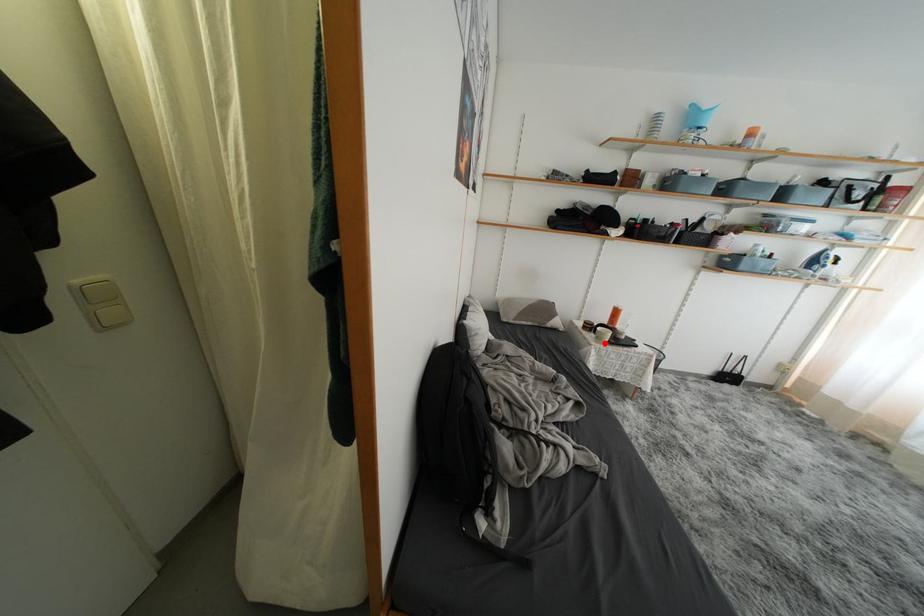
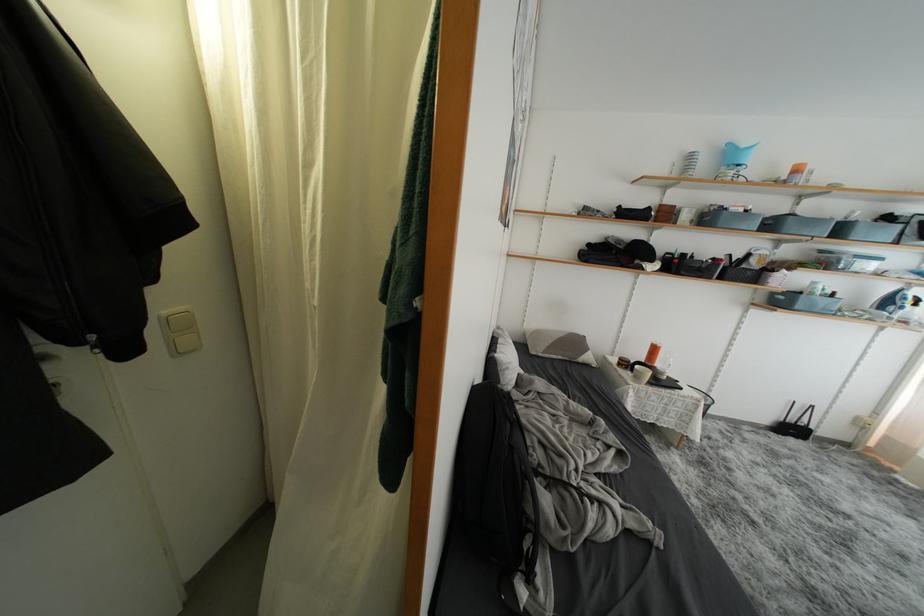
Locate, in the second image, the point that corresponds to the highlighted location in the first image.

(642, 382)